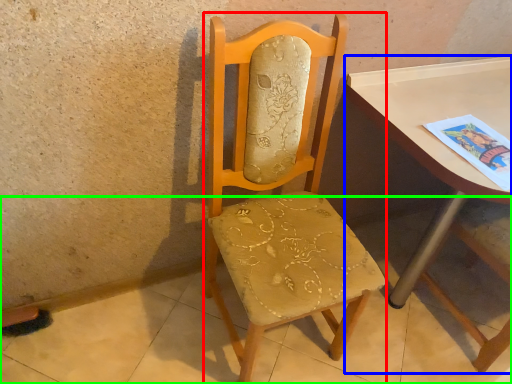
Question: Based on their relative distances, which object is farther from chair (highlighted by a red box)? Choose from table (highlighted by a blue box) and concrete (highlighted by a green box).

Choices:
 (A) table
 (B) concrete

Answer: (B)